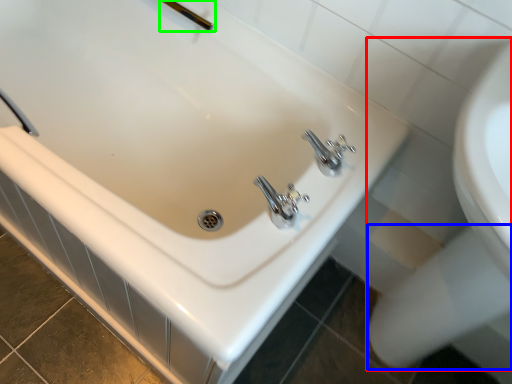
Question: Based on their relative distances, which object is nearer to sink (highlighted by a red box)? Choose from bidet (highlighted by a blue box) and shower (highlighted by a green box).

Choices:
 (A) bidet
 (B) shower

Answer: (A)